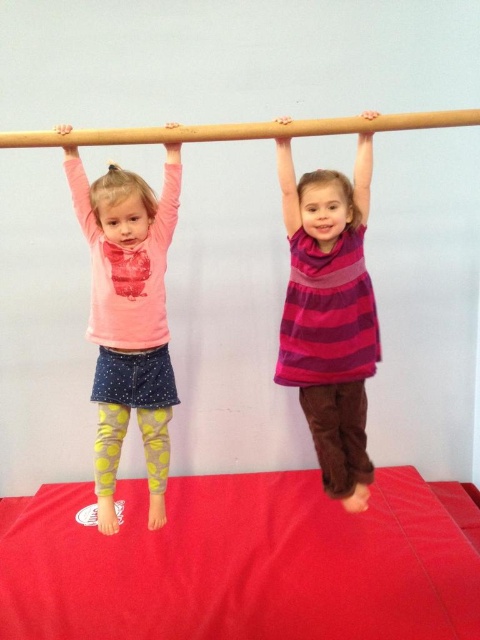
Question: Does purple striped dress at center appear on the left side of pink matte shirt at left?

Choices:
 (A) no
 (B) yes

Answer: (A)

Question: Can you confirm if red rubber mat at lower center is bigger than pink matte shirt at left?

Choices:
 (A) yes
 (B) no

Answer: (A)

Question: Among these points, which one is nearest to the camera?

Choices:
 (A) (118, 561)
 (B) (362, 320)
 (C) (116, 276)
 (D) (206, 129)

Answer: (D)

Question: Which point is closer to the camera?

Choices:
 (A) (159, 508)
 (B) (340, 298)
 (C) (407, 547)

Answer: (B)

Question: Which point is closer to the camera?

Choices:
 (A) red rubber mat at lower center
 (B) purple striped dress at center
 (C) pink matte shirt at left
 (D) wooden pole at center

Answer: (D)

Question: Does purple striped dress at center have a larger size compared to pink matte shirt at left?

Choices:
 (A) no
 (B) yes

Answer: (A)